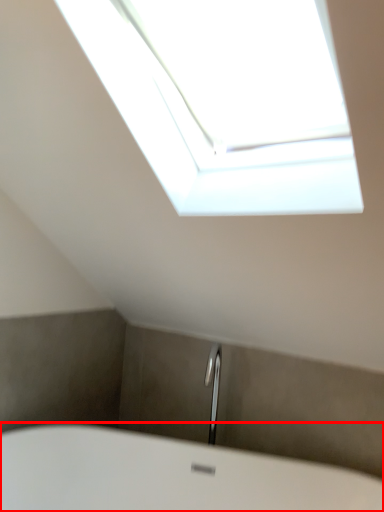
Question: Observing the image, what is the correct spatial positioning of bathtub (annotated by the red box) in reference to window?

Choices:
 (A) right
 (B) left

Answer: (B)